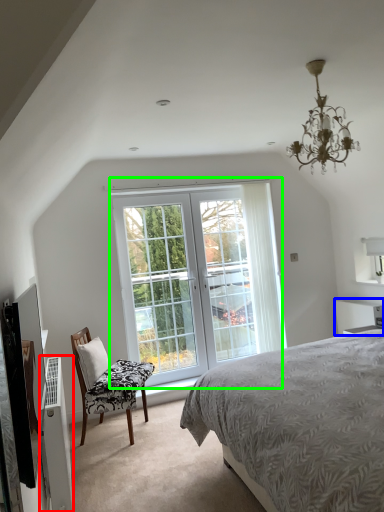
Question: Considering the real-world distances, which object is closest to air conditioner (highlighted by a red box)? vanity (highlighted by a blue box) or window (highlighted by a green box).

Choices:
 (A) vanity
 (B) window

Answer: (B)